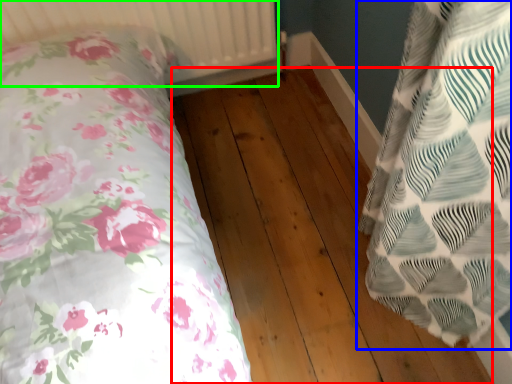
Question: Estimate the real-world distances between objects in this image. Which object is farther from hardwood (highlighted by a red box), pillow (highlighted by a blue box) or radiator (highlighted by a green box)?

Choices:
 (A) pillow
 (B) radiator

Answer: (B)